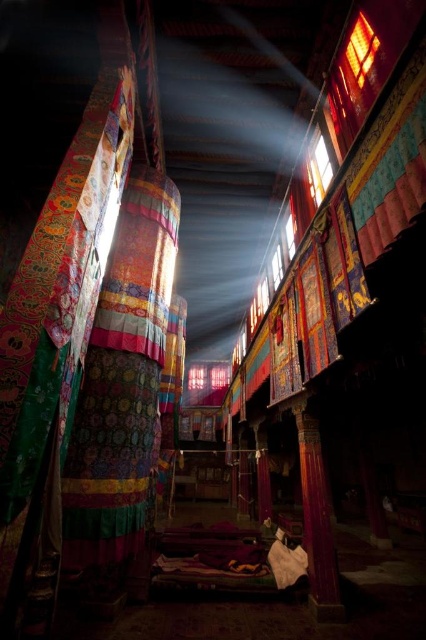
Looking at this image, you are an architect visiting this traditional Tibetan building. You notice the purple fabric column at lower right and the translucent glass window at upper center. Which object is taller?

The purple fabric column at lower right is taller than the translucent glass window at upper center according to the description.